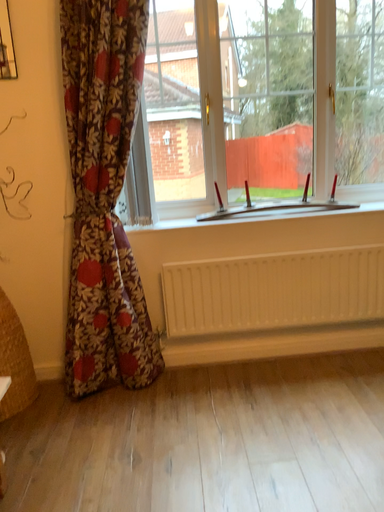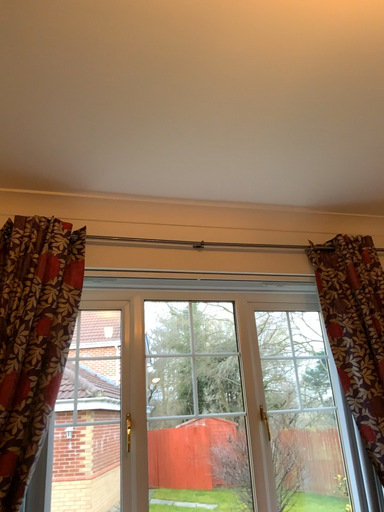
Question: How did the camera likely rotate when shooting the video?

Choices:
 (A) rotated right
 (B) rotated left

Answer: (A)